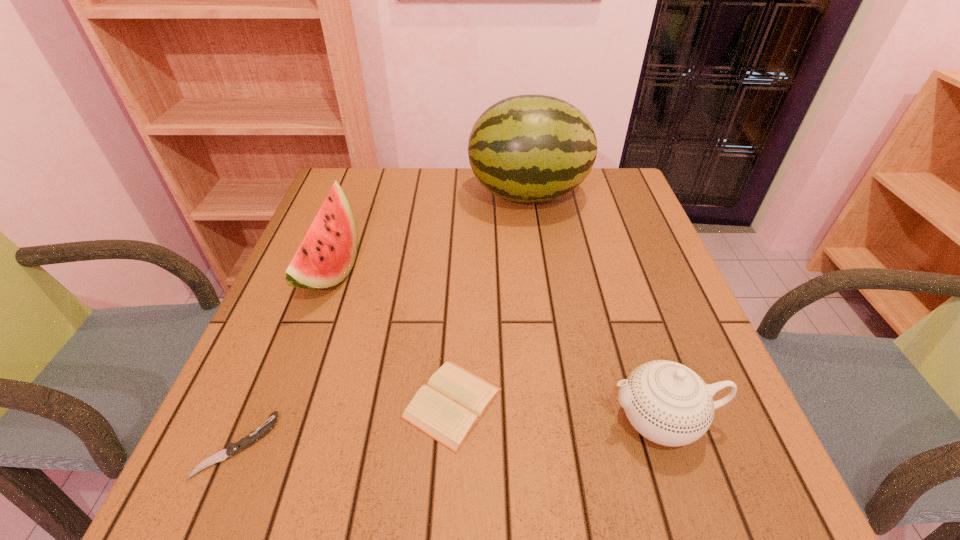
Find the location of a particular element. vacant position at the far left corner of the desktop is located at coordinates (364, 212).

In the image, there is a desktop. Where is `vacant space at the far right corner`? vacant space at the far right corner is located at coordinates (586, 201).

Where is `free space between the third tallest object and the shorter watermelon`? This screenshot has height=540, width=960. free space between the third tallest object and the shorter watermelon is located at coordinates (495, 345).

Identify the location of vacant point located between the third shortest object and the shorter watermelon. (495, 345).

Locate an element on the screen. Image resolution: width=960 pixels, height=540 pixels. free space between the third shortest object and the tallest object is located at coordinates (594, 306).

You are a GUI agent. You are given a task and a screenshot of the screen. Output one action in this format:
    pyautogui.click(x=<x>, y=<y>)
    Task: Click on the vacant space that's between the tallest object and the pocketknife
    
    Given the screenshot: What is the action you would take?
    pyautogui.click(x=382, y=320)

At what (x,y) coordinates should I click in order to perform the action: click on free space between the taller watermelon and the diary. Please return your answer as a coordinate pair (x, y). Looking at the image, I should click on pos(491,299).

Where is `vacant area that lies between the left watermelon and the shortest object`? vacant area that lies between the left watermelon and the shortest object is located at coordinates (283, 359).

This screenshot has width=960, height=540. I want to click on free space that is in between the diary and the third shortest object, so click(x=557, y=411).

Locate an element on the screen. unoccupied position between the taller watermelon and the shorter watermelon is located at coordinates (429, 233).